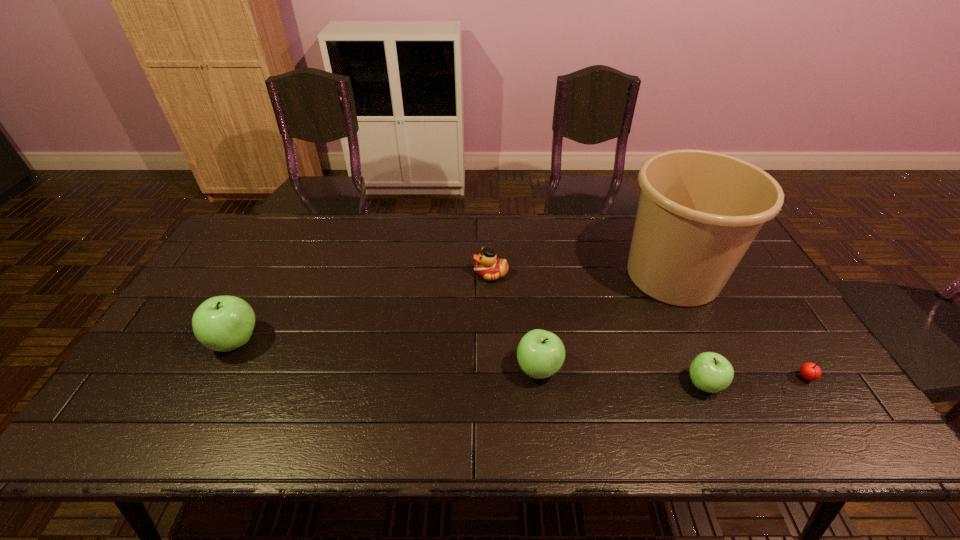
The height and width of the screenshot is (540, 960). What are the coordinates of `free region located on the back of the shortest apple` in the screenshot? It's located at (669, 303).

Identify the location of vacant space located 0.390m on the left of the bucket. (491, 275).

At what (x,y) coordinates should I click in order to perform the action: click on vacant region located on the face of the second object from left to right. Please return your answer as a coordinate pair (x, y). The image size is (960, 540). Looking at the image, I should click on (432, 274).

Where is `vacant space situated 0.150m on the face of the second object from left to right`? vacant space situated 0.150m on the face of the second object from left to right is located at coordinates (x=425, y=274).

Identify the location of vacant region located 0.380m on the face of the second object from left to right. The width and height of the screenshot is (960, 540). (352, 274).

At what (x,y) coordinates should I click in order to perform the action: click on free region located 0.370m on the left of the cherry. Please return your answer as a coordinate pair (x, y). Looking at the image, I should click on (650, 379).

Locate an element on the screen. The image size is (960, 540). object that is at the far edge is located at coordinates (699, 211).

Identify the location of cherry that is at the near edge. The image size is (960, 540). (810, 371).

Where is `object at the left edge`? This screenshot has height=540, width=960. object at the left edge is located at coordinates (223, 323).

Image resolution: width=960 pixels, height=540 pixels. I want to click on bucket located at the right edge, so click(x=699, y=211).